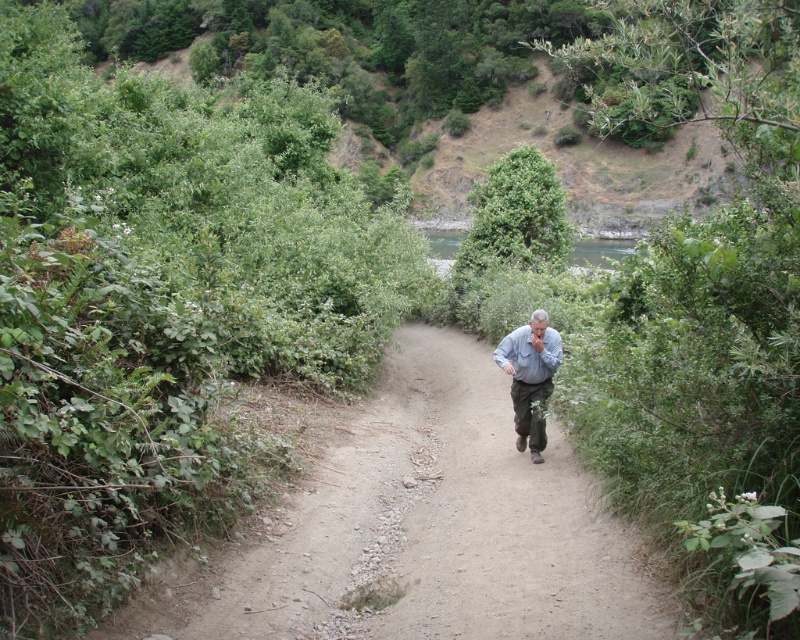
Question: Is dirt path at center wider than gray fabric shirt at center?

Choices:
 (A) yes
 (B) no

Answer: (A)

Question: Does dirt path at center appear over gray fabric shirt at center?

Choices:
 (A) yes
 (B) no

Answer: (B)

Question: Which object is farther from the camera taking this photo?

Choices:
 (A) dirt path at center
 (B) gray fabric shirt at center

Answer: (B)

Question: Is dirt path at center below gray fabric shirt at center?

Choices:
 (A) no
 (B) yes

Answer: (B)

Question: Which object appears farthest from the camera in this image?

Choices:
 (A) gray fabric shirt at center
 (B) dirt path at center

Answer: (A)